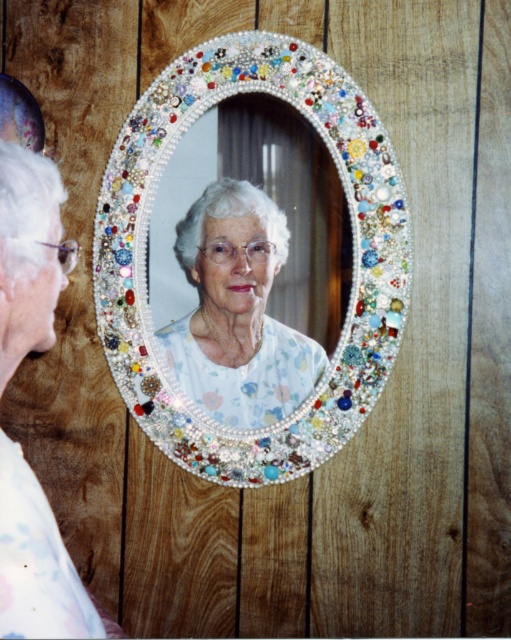
Question: Which of the following is the farthest from the observer?

Choices:
 (A) pearl-like mosaic mirror at center
 (B) floral fabric blouse at left

Answer: (A)

Question: Does pearl-like mosaic mirror at center have a smaller size compared to floral fabric blouse at left?

Choices:
 (A) no
 (B) yes

Answer: (A)

Question: Based on their relative distances, which object is nearer to the pearl-like mosaic mirror at center?

Choices:
 (A) floral fabric blouse at center
 (B) floral fabric blouse at left

Answer: (A)

Question: Which point is closer to the camera?

Choices:
 (A) (44, 547)
 (B) (145, 170)
 (C) (214, 212)

Answer: (A)

Question: Can you confirm if pearl-like mosaic mirror at center is positioned to the right of floral fabric blouse at left?

Choices:
 (A) yes
 (B) no

Answer: (A)

Question: Does pearl-like mosaic mirror at center appear on the left side of floral fabric blouse at center?

Choices:
 (A) yes
 (B) no

Answer: (B)